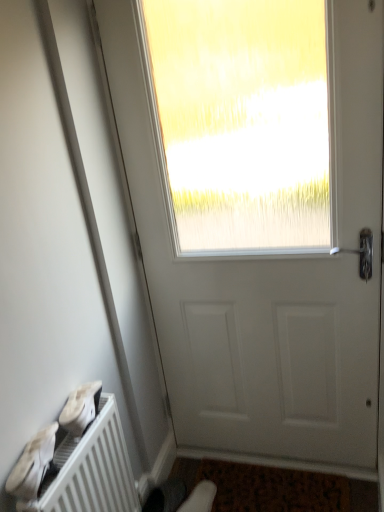
Question: Would you say white matte shoe at lower left, marked as the 1th shoe in a front-to-back arrangement, is inside or outside white matte door at center?

Choices:
 (A) inside
 (B) outside

Answer: (B)

Question: Is point (46, 453) positioned closer to the camera than point (332, 237)?

Choices:
 (A) closer
 (B) farther

Answer: (A)

Question: Which object is the closest to the brown textured mat at lower center?

Choices:
 (A) white suede shoe at lower center, which ranks as the 1th shoe in back-to-front order
 (B) white matte radiator at lower left
 (C) white matte shoe at lower left, marked as the first shoe in a top-to-bottom arrangement
 (D) white matte door at center
 (E) white matte shoe at lower left, the 1th shoe from the left

Answer: (A)

Question: Considering the real-world distances, which object is closest to the white suede shoe at lower center, the 1th shoe from the bottom?

Choices:
 (A) white matte shoe at lower left, which is the second shoe from back to front
 (B) white matte door at center
 (C) white matte radiator at lower left
 (D) white matte shoe at lower left, the 3th shoe from the back
 (E) brown textured mat at lower center

Answer: (E)